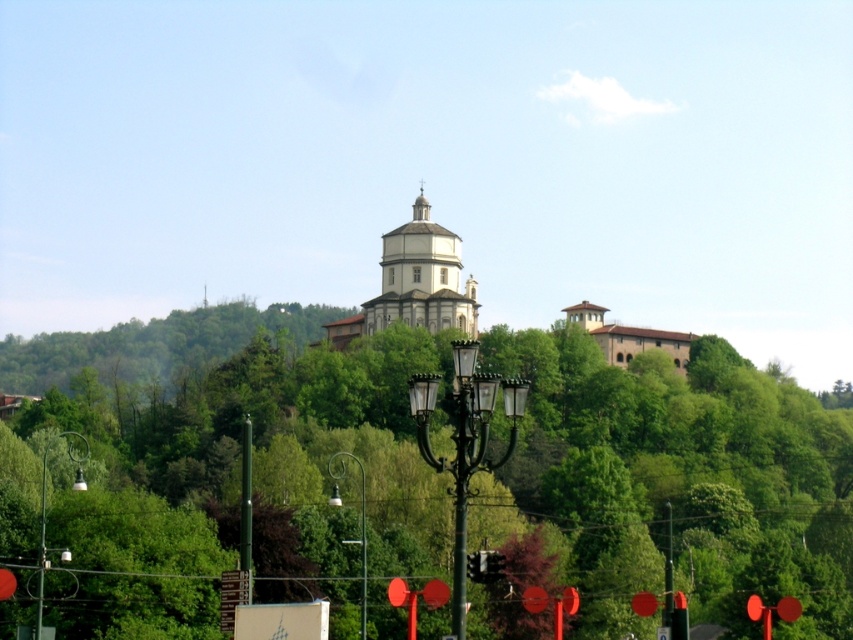
You are standing on the street and want to walk towards the green leafy tree at upper center. Which direction should you turn from the green wrought iron streetlight at center to face the tree?

The green leafy tree at upper center is to the right of the green wrought iron streetlight at center, so you should turn right to face the tree.

You are an architect designing a new pathway that needs to pass between the green leafy tree at upper center and the large ornate building on the hill. Based on their positions, which direction should the pathway curve to avoid the tree?

The green leafy tree at upper center is located at coordinates point (676, 481). Since the building is on the hill, the pathway should curve around the tree towards the lower left to avoid it while maintaining access to the building.